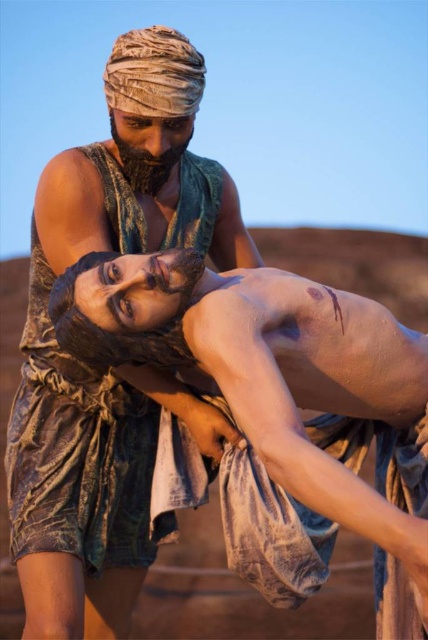
Question: Which of the following is the farthest from the observer?

Choices:
 (A) smooth skin wrestler at center
 (B) brown textured cloth at center

Answer: (B)

Question: Among these objects, which one is farthest from the camera?

Choices:
 (A) smooth skin wrestler at center
 (B) brown textured cloth at center

Answer: (B)

Question: Which object appears farthest from the camera in this image?

Choices:
 (A) brown textured cloth at center
 (B) smooth skin wrestler at center

Answer: (A)

Question: From the image, what is the correct spatial relationship of smooth skin wrestler at center in relation to brown textured cloth at center?

Choices:
 (A) left
 (B) right

Answer: (B)

Question: Observing the image, what is the correct spatial positioning of smooth skin wrestler at center in reference to brown textured cloth at center?

Choices:
 (A) above
 (B) below

Answer: (B)

Question: Does smooth skin wrestler at center have a smaller size compared to brown textured cloth at center?

Choices:
 (A) no
 (B) yes

Answer: (B)